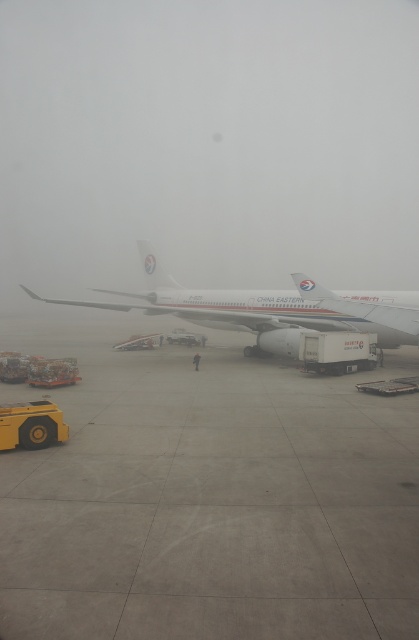
You are a pilot preparing to taxi the white matte airplane at center to the gray concrete runway at center. Based on the scene description, which direction should you move the airplane to reach the runway?

The gray concrete runway at center is closer to the viewer than the white matte airplane at center, so the pilot should move the airplane forward towards the runway since it is already positioned centrally but needs to move towards the closer runway.

You are a pilot preparing for takeoff and need to ensure that the white matte airplane at center can fit on the gray concrete runway at center. Based on the scene description, can you confirm if the runway is long enough for the airplane?

The gray concrete runway at center is smaller than the white matte airplane at center, which means the runway is not long enough to accommodate the airplane safely. Takeoff should be postponed until a longer runway is available.